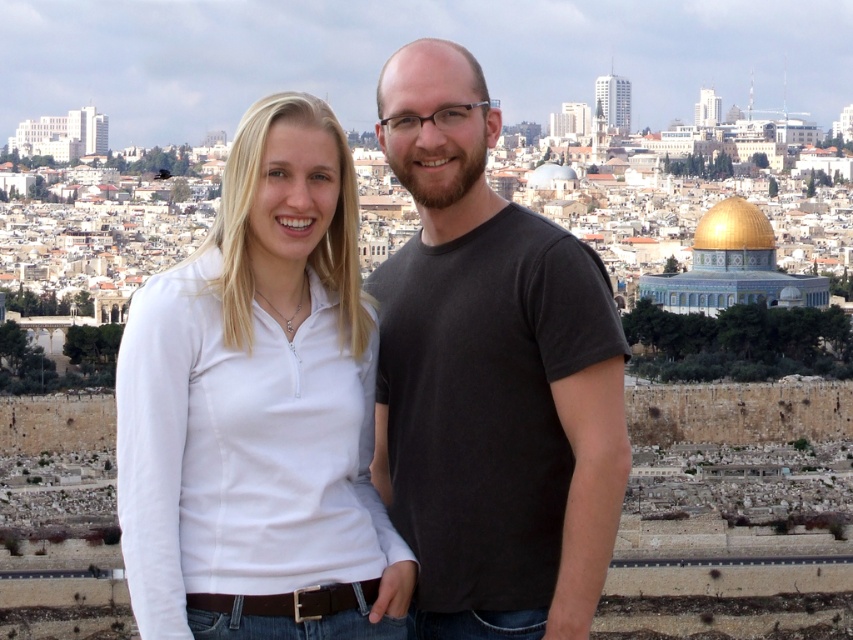
Question: Which point is closer to the camera taking this photo?

Choices:
 (A) (202, 356)
 (B) (387, 260)

Answer: (A)

Question: Which object is farther from the camera taking this photo?

Choices:
 (A) dark gray t-shirt at center
 (B) white matte shirt at center

Answer: (A)

Question: Among these objects, which one is farthest from the camera?

Choices:
 (A) white matte shirt at center
 (B) dark gray t-shirt at center

Answer: (B)

Question: Does white matte shirt at center lie behind dark gray t-shirt at center?

Choices:
 (A) no
 (B) yes

Answer: (A)

Question: Is white matte shirt at center to the right of dark gray t-shirt at center from the viewer's perspective?

Choices:
 (A) yes
 (B) no

Answer: (B)

Question: Can you confirm if white matte shirt at center is smaller than dark gray t-shirt at center?

Choices:
 (A) no
 (B) yes

Answer: (A)